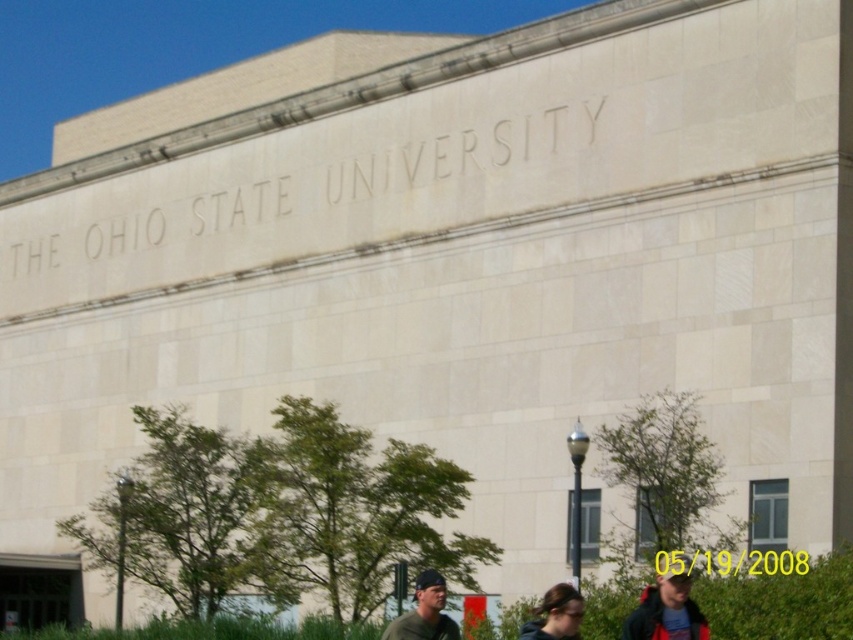
Is matte green shirt at lower center thinner than dark brown hair at lower center?

Indeed, matte green shirt at lower center has a lesser width compared to dark brown hair at lower center.

Who is positioned more to the right, matte green shirt at lower center or dark brown hair at lower center?

Positioned to the right is dark brown hair at lower center.

Describe the element at coordinates (424, 612) in the screenshot. I see `matte green shirt at lower center` at that location.

Locate an element on the screen. matte green shirt at lower center is located at coordinates (424, 612).

Does green leafy hedge at lower center have a greater width compared to dark brown hair at lower center?

Indeed, green leafy hedge at lower center has a greater width compared to dark brown hair at lower center.

Can you confirm if green leafy hedge at lower center is bigger than dark brown hair at lower center?

Yes, green leafy hedge at lower center is bigger than dark brown hair at lower center.

Is point (804, 624) positioned after point (544, 618)?

Yes.

Identify the location of green leafy hedge at lower center. The image size is (853, 640). (781, 602).

Which of these two, green leafy hedge at lower center or matte black jacket at lower right, stands shorter?

With less height is matte black jacket at lower right.

Between green leafy hedge at lower center and matte black jacket at lower right, which one has more height?

With more height is green leafy hedge at lower center.

The height and width of the screenshot is (640, 853). Find the location of `green leafy hedge at lower center`. green leafy hedge at lower center is located at coordinates (781, 602).